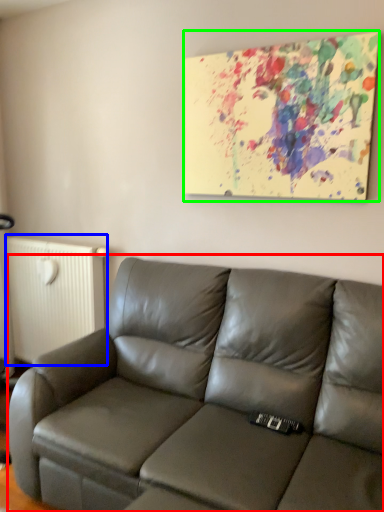
Question: Which object is positioned farthest from studio couch (highlighted by a red box)? Select from radiator (highlighted by a blue box) and picture frame (highlighted by a green box).

Choices:
 (A) radiator
 (B) picture frame

Answer: (A)